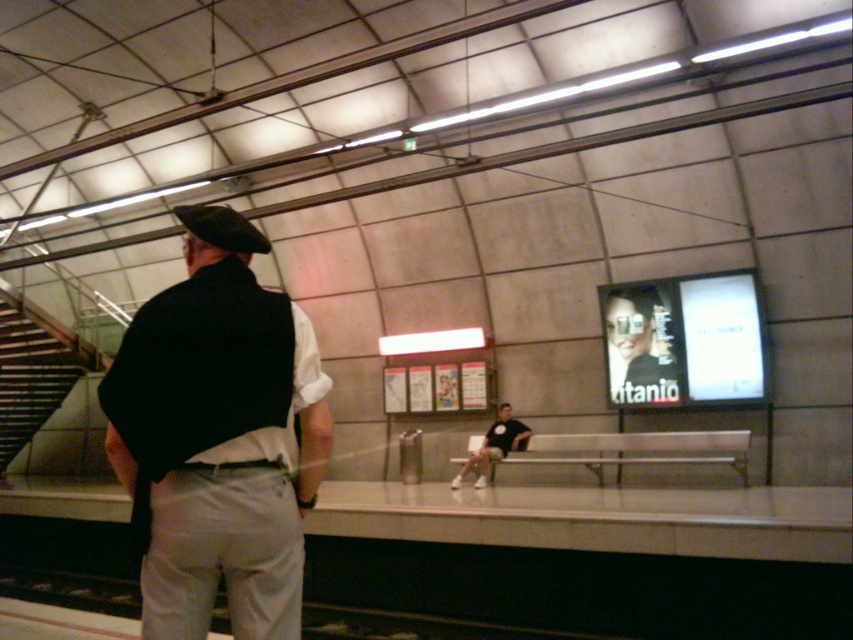
Question: Among these objects, which one is nearest to the camera?

Choices:
 (A) wooden stairs at left
 (B) black t-shirt at center
 (C) dark gray fabric vest at center

Answer: (C)

Question: Can you confirm if dark gray fabric vest at center is smaller than wooden stairs at left?

Choices:
 (A) no
 (B) yes

Answer: (B)

Question: Does wooden stairs at left appear over black t-shirt at center?

Choices:
 (A) yes
 (B) no

Answer: (A)

Question: Is dark gray fabric vest at center closer to camera compared to wooden stairs at left?

Choices:
 (A) yes
 (B) no

Answer: (A)

Question: Which object is closer to the camera taking this photo?

Choices:
 (A) wooden stairs at left
 (B) dark gray fabric vest at center

Answer: (B)

Question: Which of the following is the farthest from the observer?

Choices:
 (A) wooden stairs at left
 (B) black t-shirt at center
 (C) dark gray fabric vest at center

Answer: (A)